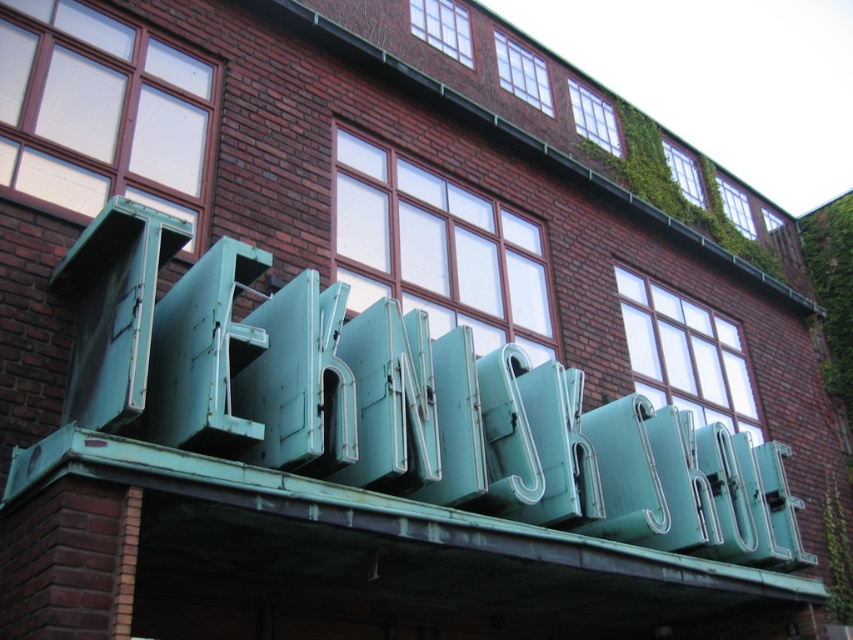
You are standing in front of a brick building with two signs. You see the green patina sign at center and the green matte neon sign at center. Which one is positioned to the left?

The green patina sign at center is positioned to the left of the green matte neon sign at center.